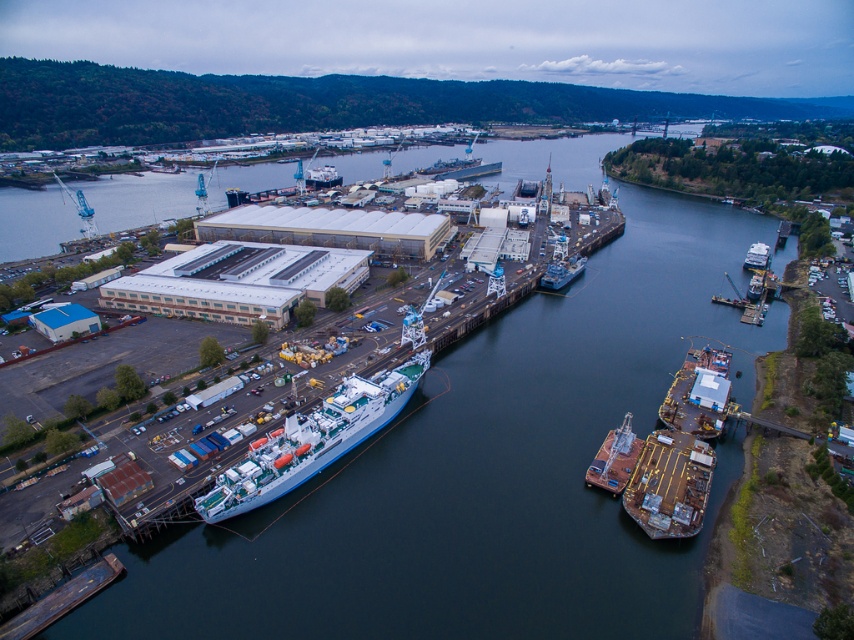
Question: Considering the relative positions of rusty metal boat at center and metallic gray ship at center in the image provided, where is rusty metal boat at center located with respect to metallic gray ship at center?

Choices:
 (A) above
 (B) below

Answer: (B)

Question: Estimate the real-world distances between objects in this image. Which object is farther from the white glossy boat at upper right?

Choices:
 (A) white matte ship at center
 (B) rusty metallic boat at lower right

Answer: (A)

Question: Considering the real-world distances, which object is closest to the rusty metallic boat at lower right?

Choices:
 (A) rusty metal boat at center
 (B) white glossy boat at upper right
 (C) metallic gray ship at center

Answer: (A)

Question: Which of the following is the farthest from the observer?

Choices:
 (A) (752, 266)
 (B) (564, 260)
 (C) (418, 586)
 (D) (273, 449)

Answer: (A)

Question: Does dark blue water at center appear on the left side of metallic gray ship at center?

Choices:
 (A) yes
 (B) no

Answer: (A)

Question: Can you confirm if dark blue water at center is positioned to the right of metallic gray ship at center?

Choices:
 (A) no
 (B) yes

Answer: (A)